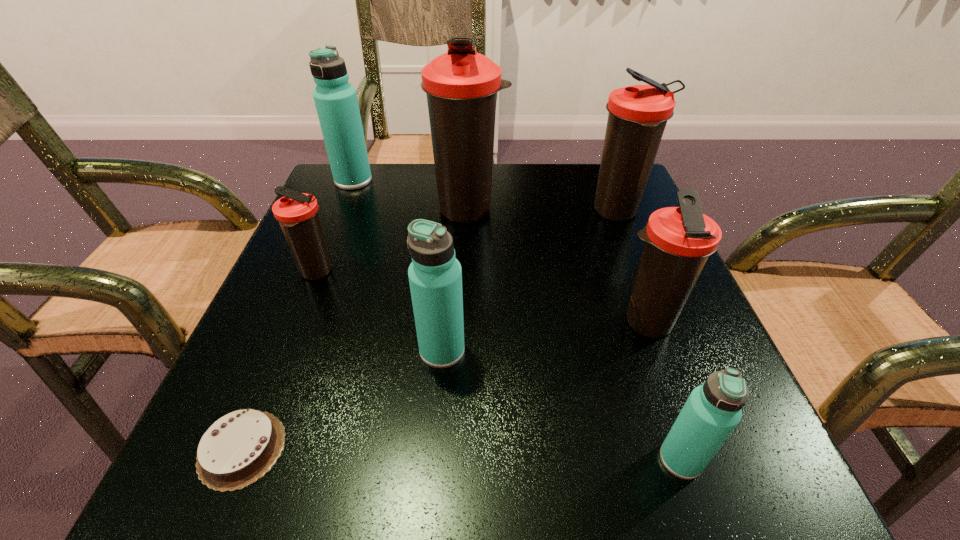
You are a GUI agent. You are given a task and a screenshot of the screen. Output one action in this format:
    pyautogui.click(x=<x>, y=<y>)
    Task: Click on the tallest thermos bottle
    This screenshot has width=960, height=540.
    Given the screenshot: What is the action you would take?
    pyautogui.click(x=461, y=85)

At what (x,y) coordinates should I click in order to perform the action: click on the tallest object. Please return your answer as a coordinate pair (x, y). Looking at the image, I should click on (461, 85).

In order to click on the second biggest brown thermos bottle in this screenshot , I will do `click(638, 114)`.

I want to click on the leftmost aqua thermos bottle, so (336, 102).

You are a GUI agent. You are given a task and a screenshot of the screen. Output one action in this format:
    pyautogui.click(x=<x>, y=<y>)
    Task: Click on the biggest aqua thermos bottle
    This screenshot has width=960, height=540.
    Given the screenshot: What is the action you would take?
    pyautogui.click(x=336, y=102)

Where is `the nearest brown thermos bottle`? the nearest brown thermos bottle is located at coordinates (678, 240).

You are a GUI agent. You are given a task and a screenshot of the screen. Output one action in this format:
    pyautogui.click(x=<x>, y=<y>)
    Task: Click on the second smallest aqua thermos bottle
    
    Given the screenshot: What is the action you would take?
    (x=435, y=276)

You are a GUI agent. You are given a task and a screenshot of the screen. Output one action in this format:
    pyautogui.click(x=<x>, y=<y>)
    Task: Click on the second nearest aqua thermos bottle
    This screenshot has width=960, height=540.
    Given the screenshot: What is the action you would take?
    pyautogui.click(x=435, y=276)

This screenshot has width=960, height=540. Identify the location of the fourth nearest thermos bottle. (297, 213).

Image resolution: width=960 pixels, height=540 pixels. In order to click on the second nearest brown thermos bottle in this screenshot , I will do `click(297, 213)`.